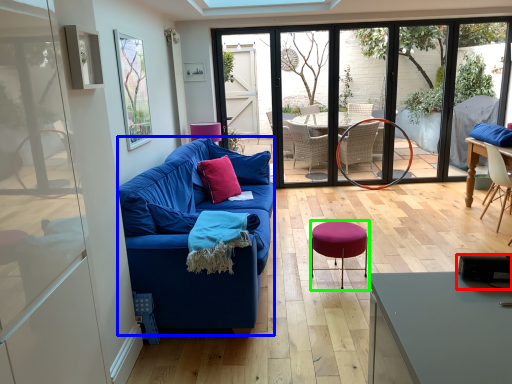
Question: Which object is the farthest from loudspeaker (highlighted by a red box)? Choose among these: studio couch (highlighted by a blue box) or bar stool (highlighted by a green box).

Choices:
 (A) studio couch
 (B) bar stool

Answer: (A)